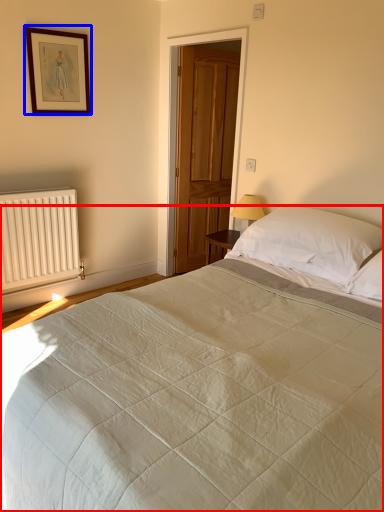
Question: Among these objects, which one is farthest to the camera, bed (highlighted by a red box) or picture frame (highlighted by a blue box)?

Choices:
 (A) bed
 (B) picture frame

Answer: (B)